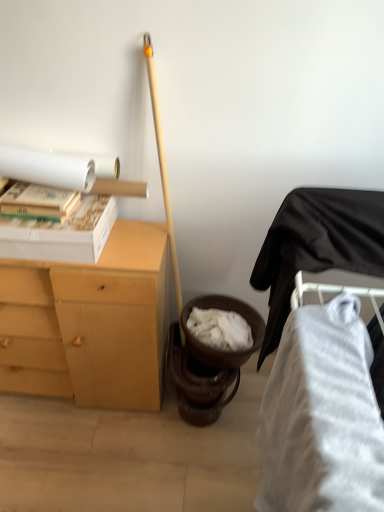
Describe the element at coordinates (321, 364) in the screenshot. I see `white striped fabric at lower right` at that location.

Describe the element at coordinates (38, 202) in the screenshot. I see `white matte book at upper left` at that location.

The width and height of the screenshot is (384, 512). Describe the element at coordinates (61, 234) in the screenshot. I see `white cardboard box at upper left` at that location.

Based on the photo, what is the approximate width of white cardboard box at upper left?

14.60 inches.

You are a GUI agent. You are given a task and a screenshot of the screen. Output one action in this format:
    pyautogui.click(x=<x>, y=<y>)
    Task: Click on the white striped fabric at lower right
    
    Given the screenshot: What is the action you would take?
    pyautogui.click(x=321, y=364)

Would you say white matte roll at upper left is outside white matte book at upper left?

white matte roll at upper left lies outside white matte book at upper left's area.

Which object is wider, white matte roll at upper left or white matte book at upper left?

white matte book at upper left is wider.

Where is `toilet paper above the white matte book at upper left (from the image's perspective)`? The width and height of the screenshot is (384, 512). toilet paper above the white matte book at upper left (from the image's perspective) is located at coordinates (56, 168).

From the image's perspective, is white matte roll at upper left on white matte book at upper left?

Correct, white matte roll at upper left appears higher than white matte book at upper left in the image.

Looking at this image, is white matte book at upper left not near white striped fabric at lower right?

That's not correct — white matte book at upper left is a little close to white striped fabric at lower right.

Could white striped fabric at lower right be considered to be inside white matte book at upper left?

No, white striped fabric at lower right is not a part of white matte book at upper left.

Can you tell me how much white matte book at upper left and white striped fabric at lower right differ in facing direction?

The angular difference between white matte book at upper left and white striped fabric at lower right is 90.9 degrees.

Is white matte book at upper left wider than white striped fabric at lower right?

No, white matte book at upper left is not wider than white striped fabric at lower right.

How distant is light brown wood desk at left from white striped fabric at lower right?

light brown wood desk at left and white striped fabric at lower right are 27.99 inches apart from each other.

Is the surface of light brown wood desk at left in direct contact with white striped fabric at lower right?

light brown wood desk at left and white striped fabric at lower right are clearly separated.

Does light brown wood desk at left have a larger size compared to white striped fabric at lower right?

Yes, light brown wood desk at left is bigger than white striped fabric at lower right.

Can you confirm if light brown wood desk at left is wider than white striped fabric at lower right?

Correct, the width of light brown wood desk at left exceeds that of white striped fabric at lower right.

How many degrees apart are the facing directions of white striped fabric at lower right and white matte roll at upper left?

They differ by 90.5 degrees in their facing directions.

Is white matte roll at upper left a part of white striped fabric at lower right?

No.

Is white striped fabric at lower right at the left side of white matte roll at upper left?

In fact, white striped fabric at lower right is to the right of white matte roll at upper left.

Considering the sizes of objects white striped fabric at lower right and white matte roll at upper left in the image provided, who is smaller, white striped fabric at lower right or white matte roll at upper left?

white matte roll at upper left is smaller.

From a real-world perspective, is white striped fabric at lower right physically above white matte book at upper left?

Actually, white striped fabric at lower right is physically below white matte book at upper left in the real world.

Is white striped fabric at lower right beside white matte book at upper left?

No.

Is white striped fabric at lower right further to the viewer compared to white matte book at upper left?

No, it is in front of white matte book at upper left.

From the image's perspective, is white striped fabric at lower right below white matte book at upper left?

Indeed, from the image's perspective, white striped fabric at lower right is shown beneath white matte book at upper left.

Considering the sizes of objects white matte book at upper left and white matte roll at upper left in the image provided, who is shorter, white matte book at upper left or white matte roll at upper left?

With less height is white matte book at upper left.

Is white matte book at upper left directly adjacent to white matte roll at upper left?

Yes, white matte book at upper left is beside white matte roll at upper left.

Does white matte book at upper left lie behind white matte roll at upper left?

Yes, the depth of white matte book at upper left is greater than that of white matte roll at upper left.

How distant is white matte book at upper left from light brown wood desk at left?

white matte book at upper left and light brown wood desk at left are 16.70 inches apart.

Considering the positions of point (17, 214) and point (85, 283), is point (17, 214) closer or farther from the camera than point (85, 283)?

Point (17, 214) is positioned closer to the camera compared to point (85, 283).

Can you confirm if white matte book at upper left is positioned to the right of light brown wood desk at left?

Correct, you'll find white matte book at upper left to the right of light brown wood desk at left.

Between white matte book at upper left and light brown wood desk at left, which one has larger width?

light brown wood desk at left.

Locate an element on the screen. The width and height of the screenshot is (384, 512). book that is behind the white matte roll at upper left is located at coordinates (38, 202).

Find the location of a particular element. This screenshot has height=512, width=384. furniture below the white matte book at upper left (from the image's perspective) is located at coordinates [x=321, y=364].

From the picture: From the image, which object appears to be nearer to white matte book at upper left, white matte roll at upper left or white striped fabric at lower right?

The object closer to white matte book at upper left is white matte roll at upper left.

Which object lies nearer to the anchor point white matte book at upper left, white striped fabric at lower right or white cardboard box at upper left?

white cardboard box at upper left is closer to white matte book at upper left.

When comparing their distances from white matte book at upper left, does white striped fabric at lower right or white matte roll at upper left seem further?

The object further to white matte book at upper left is white striped fabric at lower right.

Based on their spatial positions, is light brown wood desk at left or white cardboard box at upper left closer to white matte roll at upper left?

white cardboard box at upper left is positioned closer to the anchor white matte roll at upper left.

When comparing their distances from white striped fabric at lower right, does white matte book at upper left or light brown wood desk at left seem closer?

light brown wood desk at left is closer to white striped fabric at lower right.

Considering their positions, is white matte book at upper left positioned further to white striped fabric at lower right than white matte roll at upper left?

The object further to white striped fabric at lower right is white matte book at upper left.

Which object lies further to the anchor point white striped fabric at lower right, white matte roll at upper left or light brown wood desk at left?

The object further to white striped fabric at lower right is white matte roll at upper left.

Consider the image. When comparing their distances from light brown wood desk at left, does white matte roll at upper left or white striped fabric at lower right seem further?

Based on the image, white striped fabric at lower right appears to be further to light brown wood desk at left.

Locate an element on the screen. toilet paper between light brown wood desk at left and white striped fabric at lower right in the horizontal direction is located at coordinates (56, 168).

I want to click on book between light brown wood desk at left and white striped fabric at lower right from left to right, so click(x=38, y=202).

This screenshot has height=512, width=384. What are the coordinates of `book between white matte roll at upper left and white striped fabric at lower right` in the screenshot? It's located at (38, 202).

Locate an element on the screen. The height and width of the screenshot is (512, 384). box between white matte roll at upper left and light brown wood desk at left vertically is located at coordinates (61, 234).